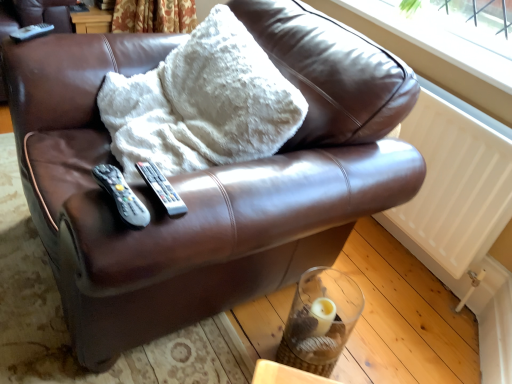
Question: From the image's perspective, is white plastic window frame at upper right on white matte remote at upper left, the 3th remote in the right-to-left sequence?

Choices:
 (A) yes
 (B) no

Answer: (A)

Question: Is white plastic window frame at upper right turned away from white matte remote at upper left, placed as the 3th remote when sorted from bottom to top?

Choices:
 (A) yes
 (B) no

Answer: (B)

Question: Is white plastic window frame at upper right far from white matte remote at upper left, the 3th remote in the right-to-left sequence?

Choices:
 (A) no
 (B) yes

Answer: (B)

Question: From a real-world perspective, is white plastic window frame at upper right beneath white matte remote at upper left, which is counted as the third remote, starting from the front?

Choices:
 (A) no
 (B) yes

Answer: (A)

Question: Are white plastic window frame at upper right and white matte remote at upper left, the 3th remote in the right-to-left sequence, making contact?

Choices:
 (A) no
 (B) yes

Answer: (A)

Question: Is white plastic window frame at upper right closer to camera compared to white matte remote at upper left, the 3th remote in the right-to-left sequence?

Choices:
 (A) no
 (B) yes

Answer: (B)

Question: Is white matte remote at upper left, the 1th remote from the top, positioned with its back to white plastic window frame at upper right?

Choices:
 (A) yes
 (B) no

Answer: (B)

Question: Does white matte remote at upper left, placed as the 3th remote when sorted from bottom to top, turn towards white plastic window frame at upper right?

Choices:
 (A) yes
 (B) no

Answer: (B)

Question: Is white matte remote at upper left, positioned as the 1th remote in left-to-right order, not near white plastic window frame at upper right?

Choices:
 (A) no
 (B) yes

Answer: (B)

Question: Is the depth of white matte remote at upper left, positioned as the 1th remote in left-to-right order, greater than that of white plastic window frame at upper right?

Choices:
 (A) yes
 (B) no

Answer: (A)

Question: Would you say white matte remote at upper left, arranged as the first remote when viewed from the back, contains white plastic window frame at upper right?

Choices:
 (A) no
 (B) yes

Answer: (A)

Question: Can you confirm if white matte remote at upper left, positioned as the 1th remote in left-to-right order, is positioned to the right of white plastic window frame at upper right?

Choices:
 (A) no
 (B) yes

Answer: (A)

Question: Is black plastic remote at center, marked as the first remote in a bottom-to-top arrangement, far away from white plastic remote at center, arranged as the 2th remote when viewed from the back?

Choices:
 (A) no
 (B) yes

Answer: (A)